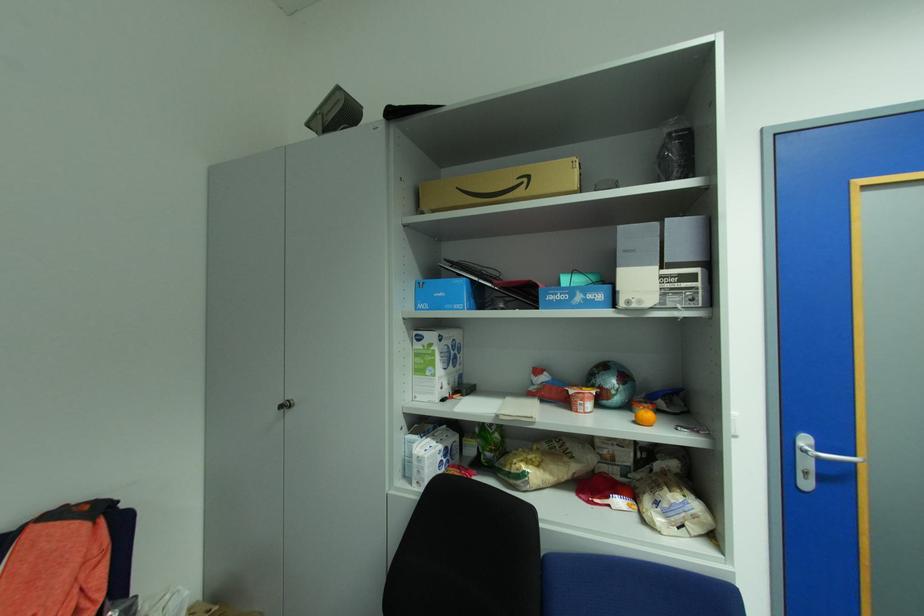
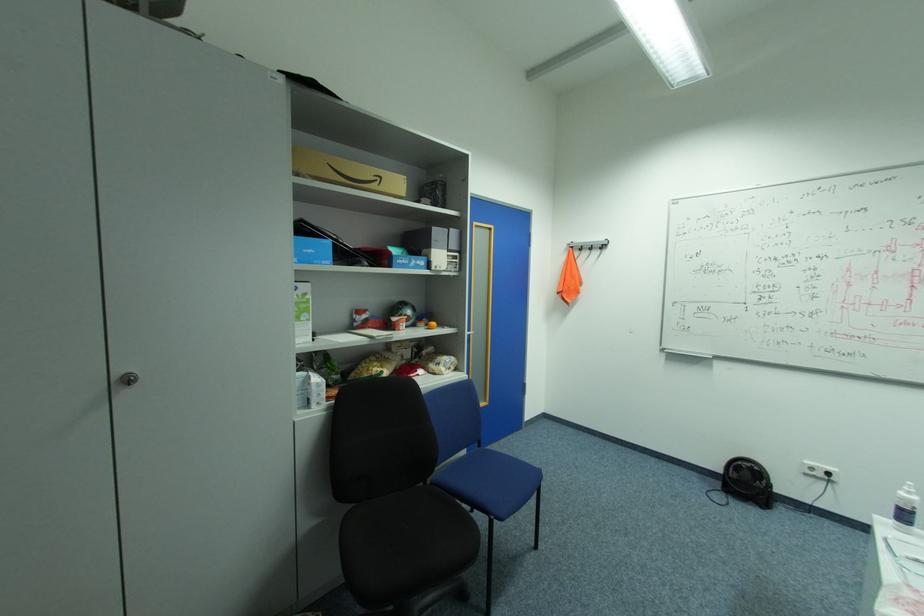
Where in the second image is the point corresponding to point (535, 177) from the first image?

(386, 177)